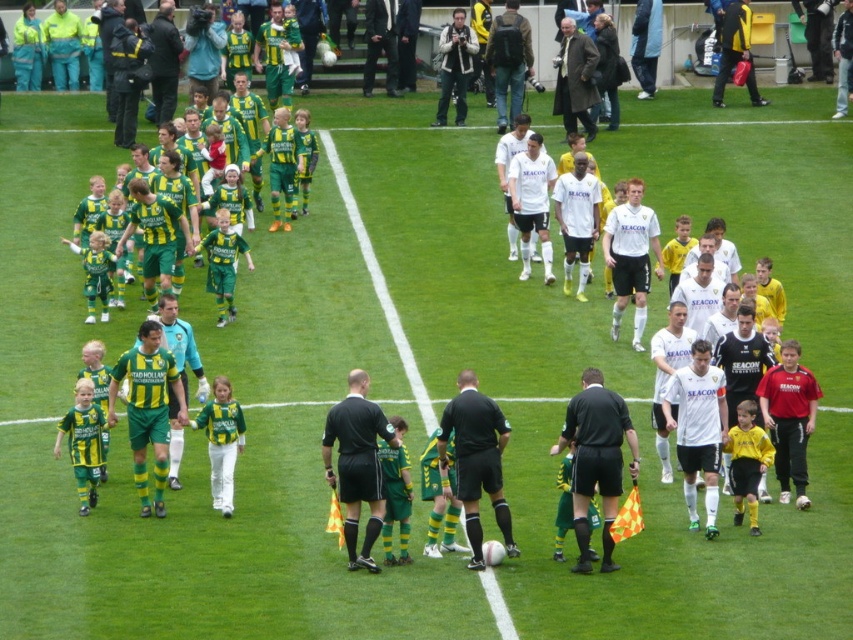
Consider the image. You are a photographer positioned at the edge of the soccer field. You want to take a photo that includes both the white leather jacket at center and the yellow jacket at center. Which jacket will appear larger in your photo?

The white leather jacket at center will appear larger in the photo because it is closer to the viewer than the yellow jacket at center.

You are a photographer positioned at the edge of the soccer field. You need to capture a photo where both the black uniformed official at center and the dark blue jacket at upper left are visible. Given their sizes, which object would appear smaller in the final photo?

The black uniformed official at center would appear smaller in the photo compared to the dark blue jacket at upper left because the description states that the black uniformed official at center has a smaller size.